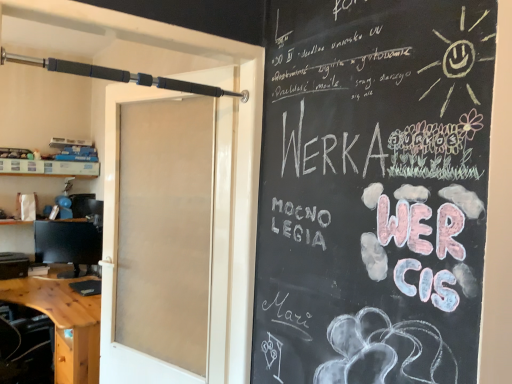
Question: Can you confirm if matte black monitor at left is positioned to the left of white frosted glass door at center?

Choices:
 (A) no
 (B) yes

Answer: (B)

Question: From the image's perspective, is matte black monitor at left over white frosted glass door at center?

Choices:
 (A) yes
 (B) no

Answer: (B)

Question: Does matte black monitor at left contain white frosted glass door at center?

Choices:
 (A) yes
 (B) no

Answer: (B)

Question: Can you confirm if matte black monitor at left is smaller than white frosted glass door at center?

Choices:
 (A) no
 (B) yes

Answer: (B)

Question: Is matte black monitor at left taller than white frosted glass door at center?

Choices:
 (A) yes
 (B) no

Answer: (B)

Question: Is matte black monitor at left wider than white frosted glass door at center?

Choices:
 (A) yes
 (B) no

Answer: (B)

Question: Is wooden desk at lower left directly adjacent to white paper bag at left?

Choices:
 (A) yes
 (B) no

Answer: (B)

Question: Considering the relative sizes of wooden desk at lower left and white paper bag at left in the image provided, is wooden desk at lower left shorter than white paper bag at left?

Choices:
 (A) no
 (B) yes

Answer: (A)

Question: Is wooden desk at lower left completely or partially outside of white paper bag at left?

Choices:
 (A) yes
 (B) no

Answer: (A)

Question: From a real-world perspective, is wooden desk at lower left physically below white paper bag at left?

Choices:
 (A) no
 (B) yes

Answer: (B)

Question: From the image's perspective, is wooden desk at lower left on top of white paper bag at left?

Choices:
 (A) yes
 (B) no

Answer: (B)

Question: From a real-world perspective, is wooden desk at lower left physically above white paper bag at left?

Choices:
 (A) yes
 (B) no

Answer: (B)

Question: Is white paper bag at left thinner than black rubberized barbell at upper left?

Choices:
 (A) no
 (B) yes

Answer: (A)